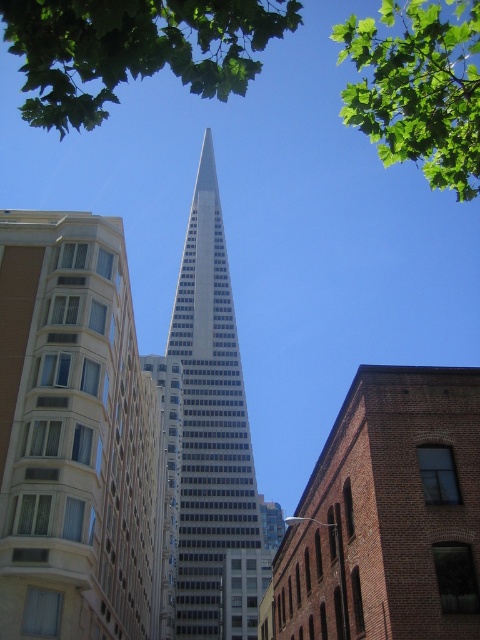
Question: Which point is closer to the camera taking this photo?

Choices:
 (A) (104, 99)
 (B) (455, 570)

Answer: (A)

Question: Which object is the closest to the green leafy tree at upper right?

Choices:
 (A) silver glass skyscraper at center
 (B) red brick building at center

Answer: (B)

Question: Estimate the real-world distances between objects in this image. Which object is farther from the green leafy tree at upper right?

Choices:
 (A) green leafy tree at upper center
 (B) red brick building at center
 (C) beige brick building at left

Answer: (C)

Question: Is beige brick building at left positioned in front of green leafy tree at upper right?

Choices:
 (A) no
 (B) yes

Answer: (A)

Question: Does silver glass skyscraper at center lie behind green leafy tree at upper center?

Choices:
 (A) no
 (B) yes

Answer: (B)

Question: Is red brick building at center wider than green leafy tree at upper center?

Choices:
 (A) yes
 (B) no

Answer: (B)